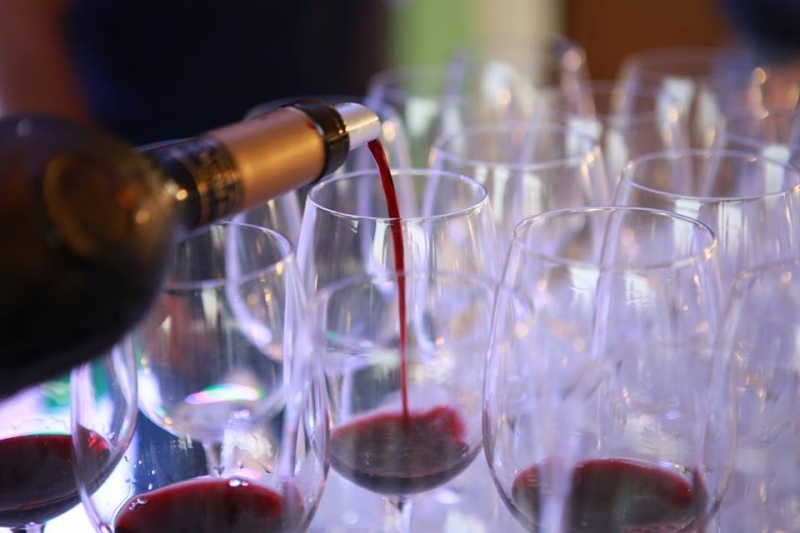
Where is `empty glass`? empty glass is located at coordinates (276, 222), (513, 181), (629, 139), (778, 383), (682, 189), (462, 99).